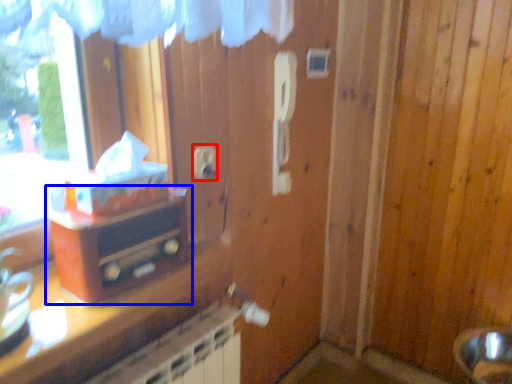
Question: Which point is closer to the camera, electric outlet (highlighted by a red box) or furniture (highlighted by a blue box)?

Choices:
 (A) electric outlet
 (B) furniture

Answer: (B)